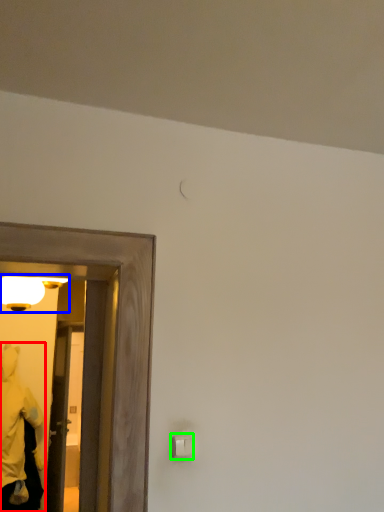
Question: Estimate the real-world distances between objects in this image. Which object is farther from person (highlighted by a red box), light fixture (highlighted by a blue box) or light switch (highlighted by a green box)?

Choices:
 (A) light fixture
 (B) light switch

Answer: (B)